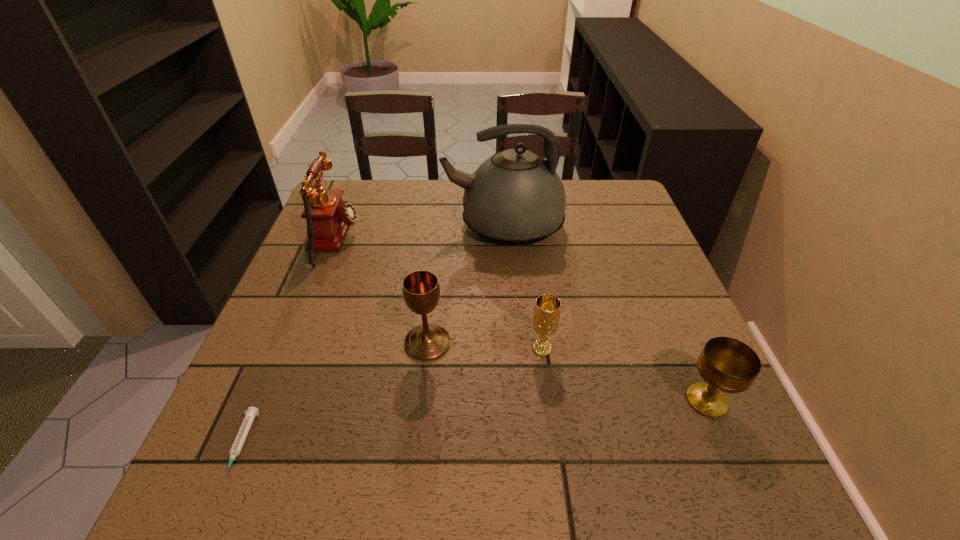
Identify the location of chalice that stands as the closest to the shortest object. The image size is (960, 540). (x=421, y=291).

Locate an element on the screen. The image size is (960, 540). vacant space that satisfies the following two spatial constraints: 1. on the dial of the third tallest object; 2. on the left side of the telephone is located at coordinates (295, 343).

The width and height of the screenshot is (960, 540). What are the coordinates of `vacant region that satisfies the following two spatial constraints: 1. on the dial of the telephone; 2. at the needle end of the syringe` in the screenshot? It's located at (x=253, y=446).

Locate an element on the screen. The image size is (960, 540). vacant space that satisfies the following two spatial constraints: 1. on the dial of the telephone; 2. on the left side of the rightmost chalice is located at coordinates (271, 401).

This screenshot has height=540, width=960. What are the coordinates of `free location that satisfies the following two spatial constraints: 1. on the dial of the second tallest object; 2. on the back side of the leftmost chalice` in the screenshot? It's located at (295, 343).